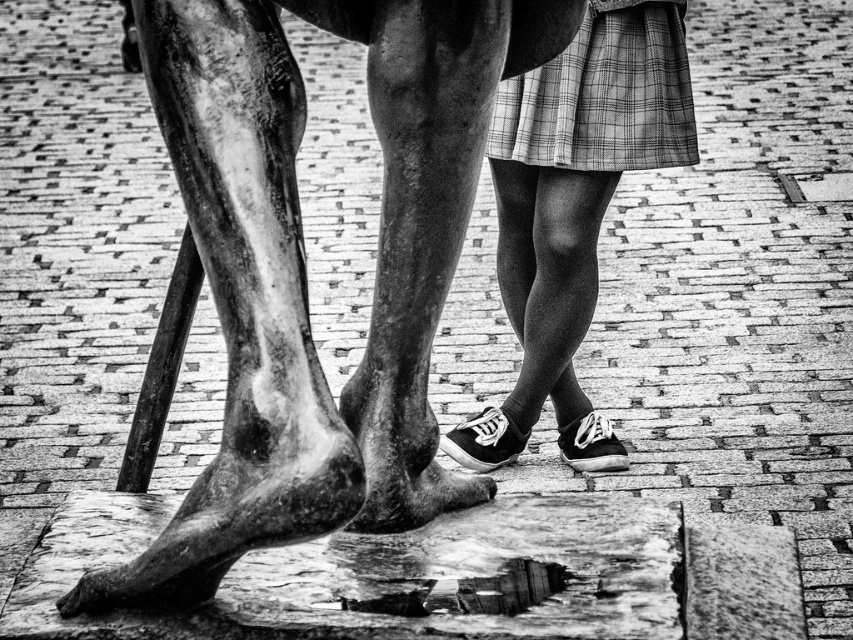
You are a tour guide explaining the layout of the historical site. A visitor asks if the bronze statue at center is positioned closer to the entrance or the exit. Based on the coordinates provided, can you determine its location?

The bronze statue at center is located at coordinates point (305, 266). Since the exact coordinates of the entrance and exit are not provided, I cannot definitively determine whether it is closer to the entrance or the exit.